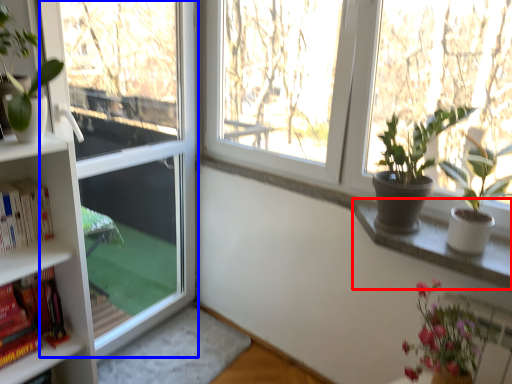
Question: Which of the following is the farthest to the observer, window sill (highlighted by a red box) or screen door (highlighted by a blue box)?

Choices:
 (A) window sill
 (B) screen door

Answer: (B)